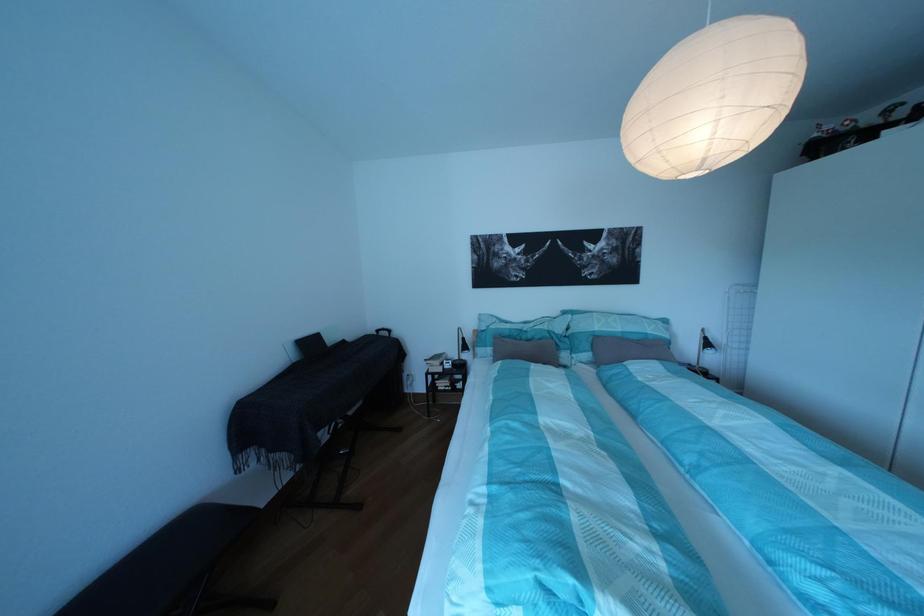
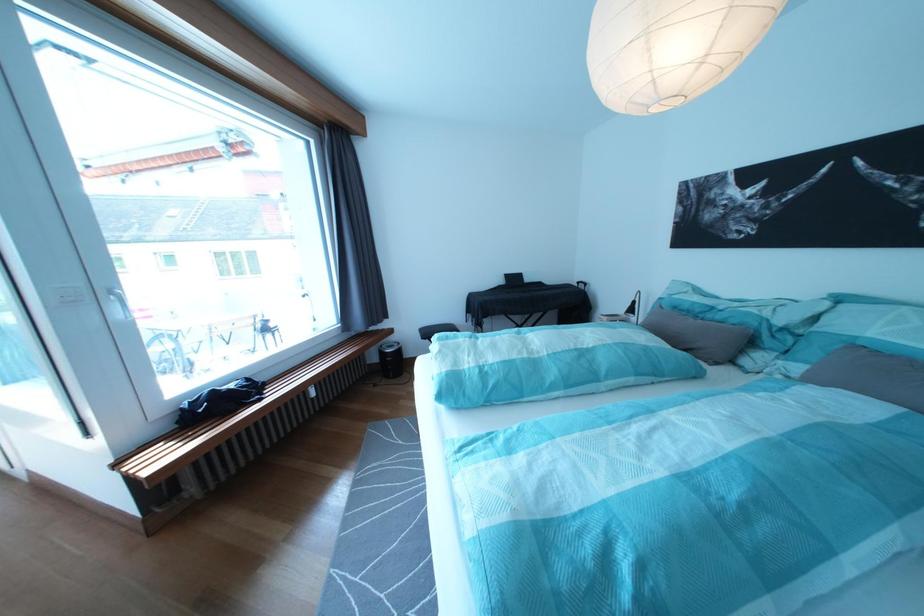
Where in the second image is the point corresponding to [582,322] from the first image?

(841, 309)